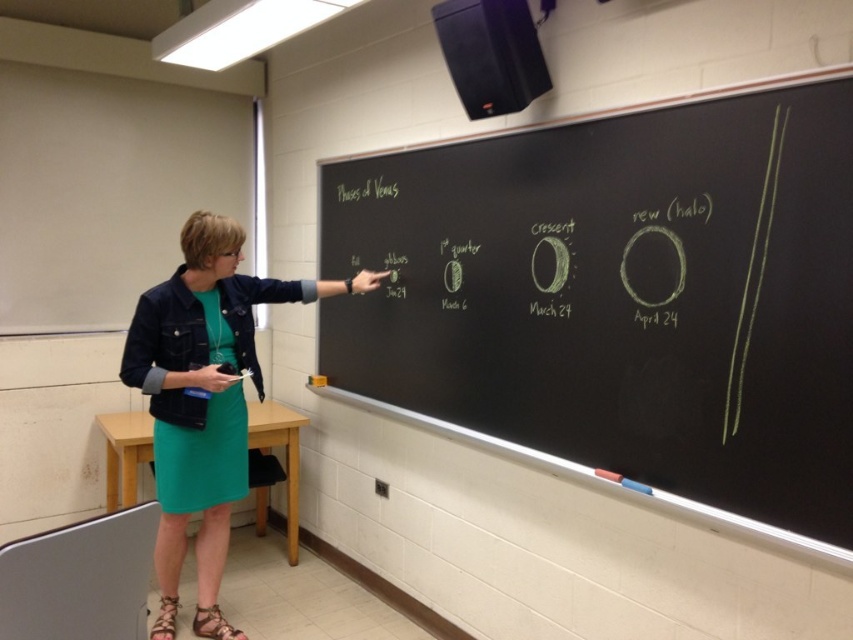
In the scene shown: Who is taller, green chalkboard at upper center or green fabric dress at center?

green fabric dress at center is taller.

Identify the location of green chalkboard at upper center. (621, 300).

Is point (373, 189) positioned behind point (169, 355)?

Yes, point (373, 189) is behind point (169, 355).

Locate an element on the screen. Image resolution: width=853 pixels, height=640 pixels. green chalkboard at upper center is located at coordinates (621, 300).